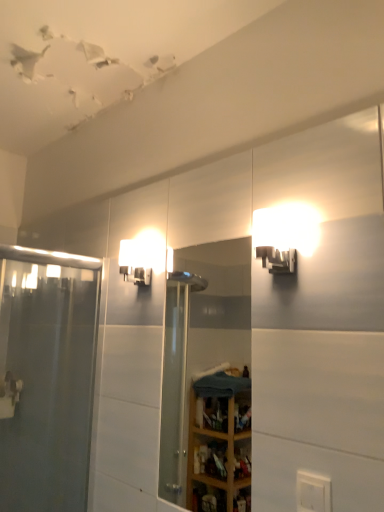
Question: Considering the positions of matte white sconce at upper right, placed as the 2th light fixture when sorted from left to right, and clear glass mirror at center in the image, is matte white sconce at upper right, placed as the 2th light fixture when sorted from left to right, wider or thinner than clear glass mirror at center?

Choices:
 (A) wide
 (B) thin

Answer: (A)

Question: Would you say matte white sconce at upper right, the 1th light fixture from the front, is inside or outside clear glass mirror at center?

Choices:
 (A) inside
 (B) outside

Answer: (B)

Question: Which is nearer to the clear glass mirror at center?

Choices:
 (A) white plastic electric outlet at lower right
 (B) matte white sconce at upper right, the first light fixture in the right-to-left sequence
 (C) matte white sconce at upper center, which is the 1th light fixture from back to front
 (D) clear glass shower door at left

Answer: (D)

Question: Which object is the closest to the matte white sconce at upper center, which ranks as the first light fixture in left-to-right order?

Choices:
 (A) clear glass shower door at left
 (B) clear glass mirror at center
 (C) matte white sconce at upper right, the 1th light fixture from the front
 (D) white plastic electric outlet at lower right

Answer: (C)